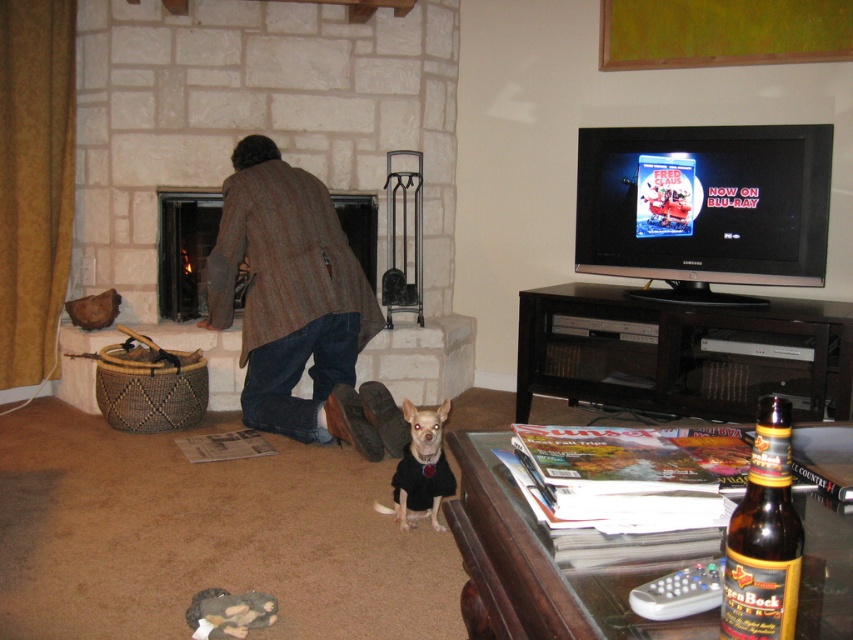
What is the exact coordinate of the brown glass beer bottle at lower right?

The brown glass beer bottle at lower right is located at point (764, 538).

You are a guest in this living room and you want to hang your coat on the nearest available hook. The brown wool coat at center is already hanging there. Can you hang your coat above the white fur dog at center without the dog being able to reach it?

The brown wool coat at center is much taller than the white fur dog at center, so hanging your coat above the brown wool coat at center would place it out of the dog s reach.